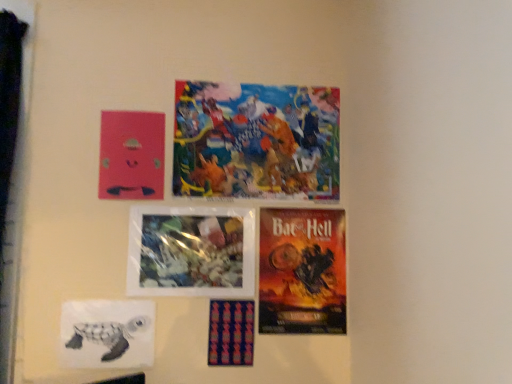
Question: Looking at their shapes, would you say textured fabric poster at center, marked as the 1th poster in a bottom-to-top arrangement, is wider or thinner than pink matte poster at upper left, which is counted as the 5th poster, starting from the bottom?

Choices:
 (A) thin
 (B) wide

Answer: (B)

Question: In the image, is textured fabric poster at center, the sixth poster from the top, on the left side or the right side of pink matte poster at upper left, which is counted as the 5th poster, starting from the bottom?

Choices:
 (A) left
 (B) right

Answer: (B)

Question: Which of these objects is positioned closest to the textured fabric poster at center, the sixth poster from the top?

Choices:
 (A) translucent plastic flowers at center, which ranks as the 4th poster in bottom-to-top order
 (B) orange matte poster at lower right, acting as the 3th poster starting from the bottom
 (C) pink matte poster at upper left, which is counted as the 5th poster, starting from the bottom
 (D) white paper turtle at lower left, which is counted as the fifth poster, starting from the top
 (E) colorful collage at upper center, the first poster viewed from the top

Answer: (A)

Question: Which object is the farthest from the translucent plastic flowers at center, which ranks as the 4th poster in bottom-to-top order?

Choices:
 (A) colorful collage at upper center, the first poster viewed from the top
 (B) pink matte poster at upper left, acting as the second poster starting from the top
 (C) white paper turtle at lower left, which is counted as the fifth poster, starting from the top
 (D) textured fabric poster at center, the sixth poster from the top
 (E) orange matte poster at lower right, acting as the 3th poster starting from the bottom

Answer: (A)